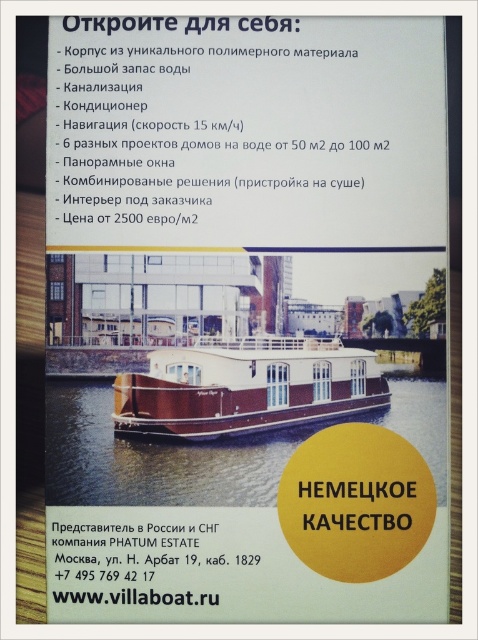
Between brown wooden boat at center and brown polished wood boat at center, which one appears on the left side from the viewer's perspective?

brown wooden boat at center is more to the left.

Can you confirm if brown wooden boat at center is positioned to the right of brown polished wood boat at center?

In fact, brown wooden boat at center is to the left of brown polished wood boat at center.

You are a GUI agent. You are given a task and a screenshot of the screen. Output one action in this format:
    pyautogui.click(x=<x>, y=<y>)
    Task: Click on the brown wooden boat at center
    This screenshot has width=478, height=640.
    Given the screenshot: What is the action you would take?
    pyautogui.click(x=152, y=458)